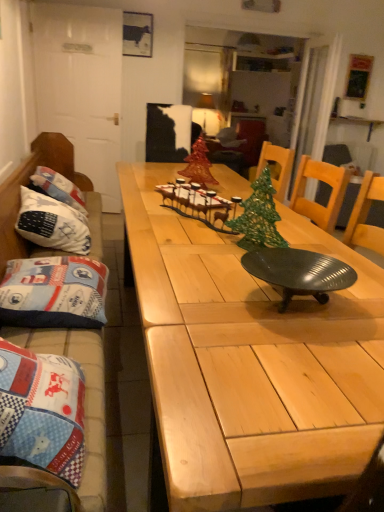
This screenshot has height=512, width=384. What are the coordinates of `vacant space to the left of metallic dark green tray at center` in the screenshot? It's located at (193, 296).